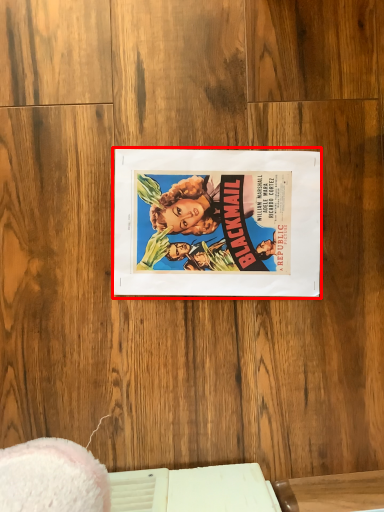
Question: From the image's perspective, what is the correct spatial relationship of paperback book (annotated by the red box) in relation to table?

Choices:
 (A) above
 (B) below

Answer: (A)